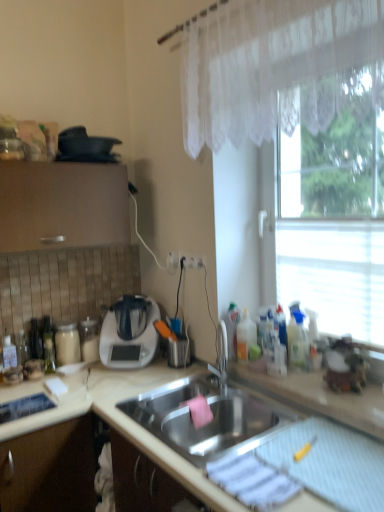
Question: Considering the positions of white lace curtain at upper right and transparent glass window at right in the image, is white lace curtain at upper right bigger or smaller than transparent glass window at right?

Choices:
 (A) big
 (B) small

Answer: (A)

Question: Is white lace curtain at upper right inside the boundaries of transparent glass window at right, or outside?

Choices:
 (A) outside
 (B) inside

Answer: (A)

Question: Which is farther from the beige matte countertop at center?

Choices:
 (A) white lace curtain at upper right
 (B) stainless steel sink at center
 (C) white plastic electric outlet at center
 (D) white plastic appliance at center-left, which is counted as the first appliance, starting from the bottom
 (E) black matte pan at upper left, marked as the 1th appliance in a top-to-bottom arrangement

Answer: (A)

Question: Based on their relative distances, which object is nearer to the stainless steel sink at center?

Choices:
 (A) white plastic appliance at center-left, which is counted as the first appliance, starting from the bottom
 (B) white plastic electric outlet at center
 (C) beige matte countertop at center
 (D) transparent glass window at right
 (E) white lace curtain at upper right

Answer: (C)